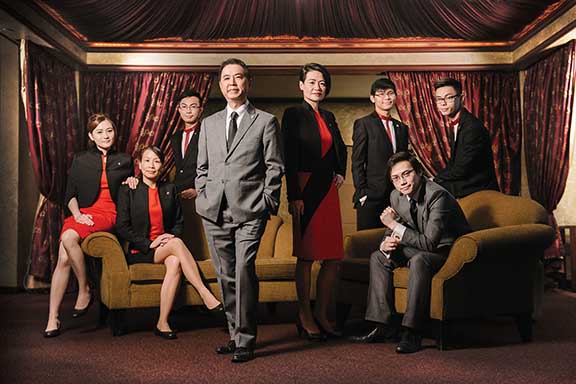
Find the location of a particular element. maroon draped fabric is located at coordinates (53, 95), (126, 92), (162, 97), (419, 96), (496, 89), (550, 83), (469, 15), (357, 10), (219, 15), (124, 15).